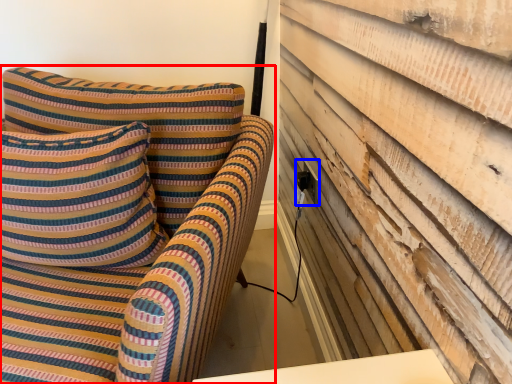
Question: Which object is closer to the camera taking this photo, furniture (highlighted by a red box) or electric outlet (highlighted by a blue box)?

Choices:
 (A) furniture
 (B) electric outlet

Answer: (A)